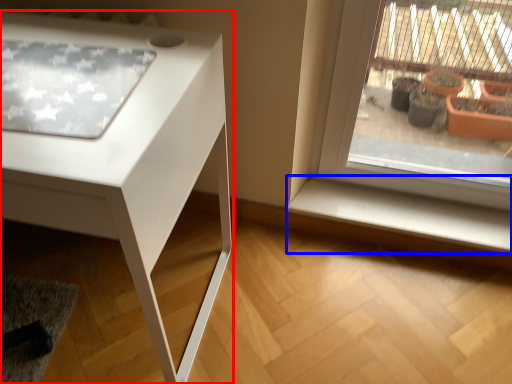
Question: Which of the following is the closest to the observer, table (highlighted by a red box) or window sill (highlighted by a blue box)?

Choices:
 (A) table
 (B) window sill

Answer: (A)